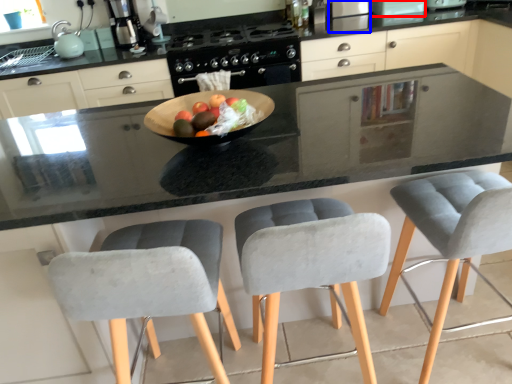
Question: Which of the following is the closest to the observer, appliance (highlighted by a red box) or appliance (highlighted by a blue box)?

Choices:
 (A) appliance
 (B) appliance

Answer: (A)